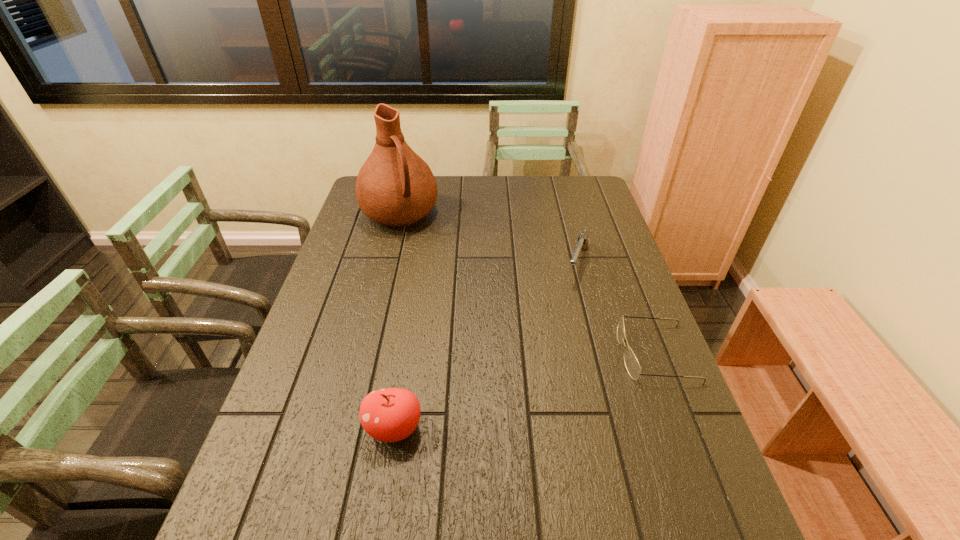
In order to click on blank space that satisfies the following two spatial constraints: 1. on the front side of the spectacles; 2. on the front-facing side of the tallest object in this screenshot , I will do click(x=366, y=354).

Find the location of a particular element. This screenshot has width=960, height=540. vacant point that satisfies the following two spatial constraints: 1. on the back side of the second nearest object; 2. on the front-facing side of the nearest object is located at coordinates (406, 354).

I want to click on vacant space that satisfies the following two spatial constraints: 1. on the front side of the third shortest object; 2. on the left side of the pitcher, so click(x=347, y=428).

At what (x,y) coordinates should I click in order to perform the action: click on vacant position in the image that satisfies the following two spatial constraints: 1. on the front side of the shortest object; 2. on the front-facing side of the farthest object. Please return your answer as a coordinate pair (x, y). This screenshot has height=540, width=960. Looking at the image, I should click on (366, 354).